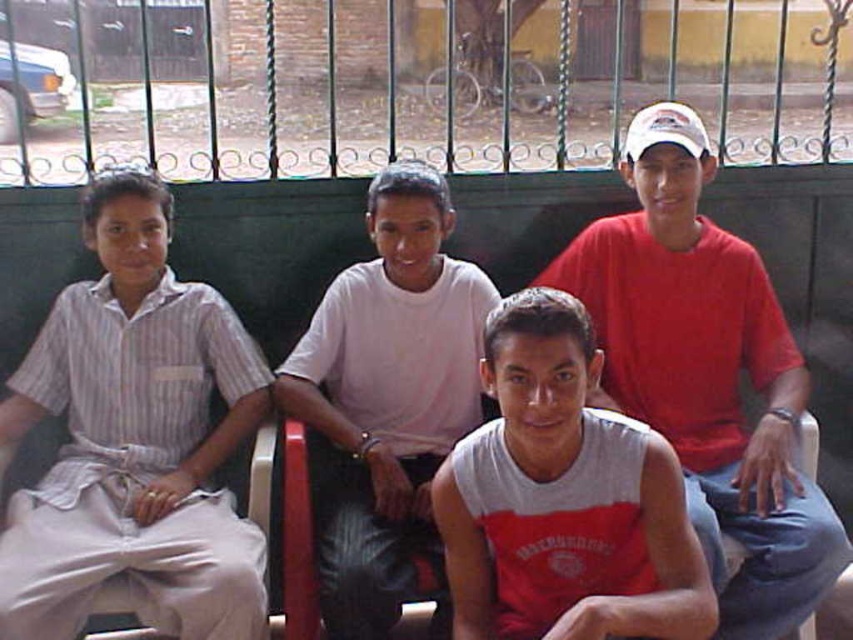
Which is behind, point (701, 342) or point (368, 550)?

Point (701, 342)

Is matte red t-shirt at center further to camera compared to white cotton shirt at center?

Yes, matte red t-shirt at center is behind white cotton shirt at center.

Locate an element on the screen. matte red t-shirt at center is located at coordinates (706, 372).

Which of these two, matte red t-shirt at center or gray matte tank top at center, stands taller?

With more height is matte red t-shirt at center.

Does matte red t-shirt at center appear on the left side of gray matte tank top at center?

No, matte red t-shirt at center is not to the left of gray matte tank top at center.

Is point (721, 474) positioned behind point (508, 344)?

Yes.

Locate an element on the screen. The height and width of the screenshot is (640, 853). matte red t-shirt at center is located at coordinates (706, 372).

Is white striped shirt at left bigger than matte red t-shirt at center?

Incorrect, white striped shirt at left is not larger than matte red t-shirt at center.

Can you confirm if white striped shirt at left is positioned to the right of matte red t-shirt at center?

In fact, white striped shirt at left is to the left of matte red t-shirt at center.

Does point (102, 294) lie in front of point (605, 337)?

Yes, it is.

This screenshot has width=853, height=640. Find the location of `white striped shirt at left`. white striped shirt at left is located at coordinates (134, 440).